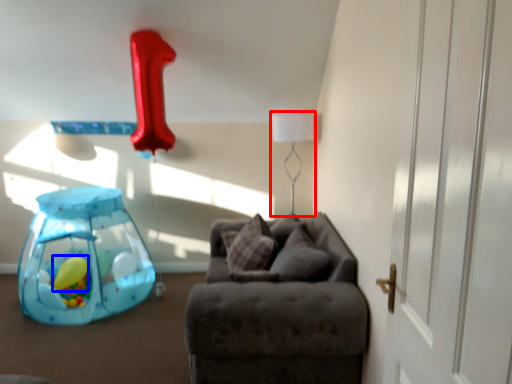
Question: Among these objects, which one is farthest to the camera, table lamp (highlighted by a red box) or balloon (highlighted by a blue box)?

Choices:
 (A) table lamp
 (B) balloon

Answer: (B)